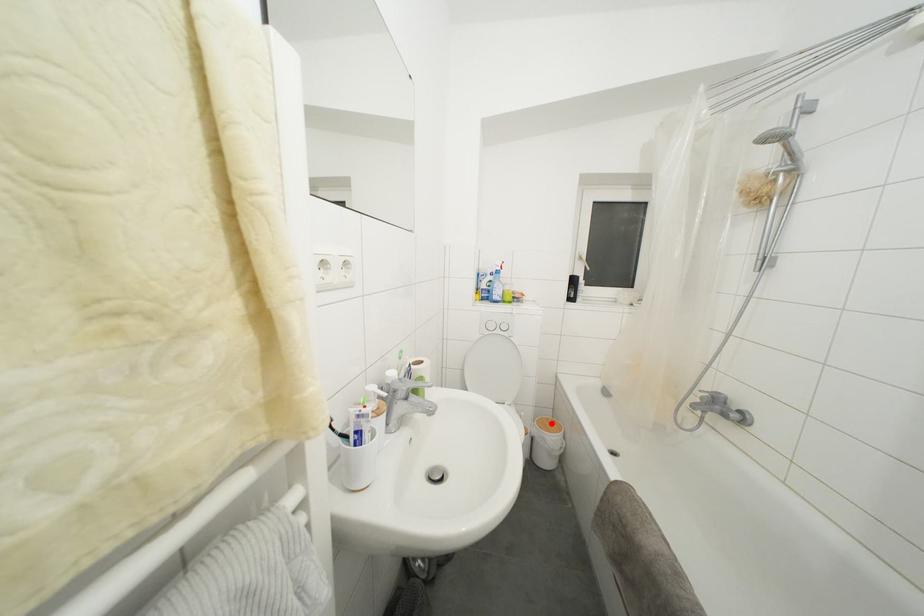
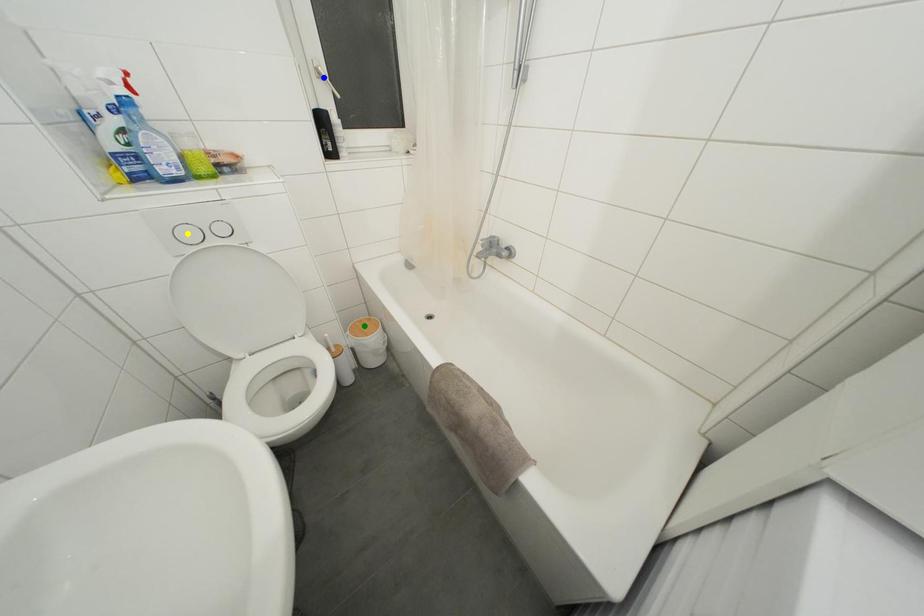
Question: I am providing you with two images of the same scene from different viewpoints. A red point is marked on the first image. You are given multiple points on the second image. Which point in image 2 represents the same 3d spot as the red point in image 1?

Choices:
 (A) yellow point
 (B) green point
 (C) blue point

Answer: (B)